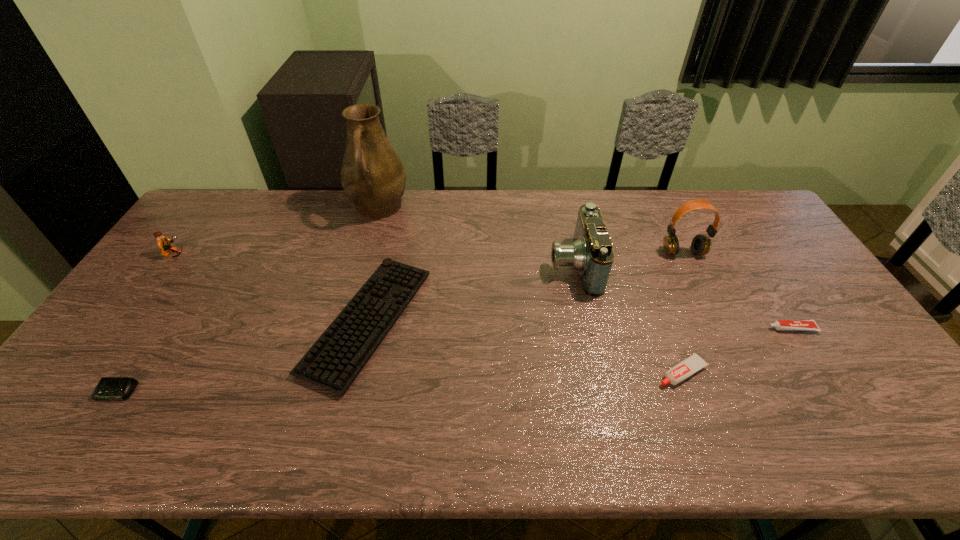
Locate an element on the screen. This screenshot has height=540, width=960. the tallest object is located at coordinates (x=373, y=177).

At what (x,y) coordinates should I click in order to perform the action: click on pitcher. Please return your answer as a coordinate pair (x, y). This screenshot has height=540, width=960. Looking at the image, I should click on (373, 177).

The image size is (960, 540). Find the location of `the second object from right to left`. the second object from right to left is located at coordinates (701, 244).

Find the location of a particular element. Image resolution: width=960 pixels, height=540 pixels. camcorder is located at coordinates 591,254.

Where is `the fourth object from right to left`? The image size is (960, 540). the fourth object from right to left is located at coordinates (591, 254).

Find the location of a particular element. The width and height of the screenshot is (960, 540). Lego is located at coordinates (163, 242).

The image size is (960, 540). Identify the location of the leftmost object. (163, 242).

This screenshot has width=960, height=540. I want to click on computer keyboard, so click(x=334, y=361).

Identify the location of the left toothpaste. The width and height of the screenshot is (960, 540). (683, 370).

Locate an element on the screen. Image resolution: width=960 pixels, height=540 pixels. the nearer toothpaste is located at coordinates (683, 370).